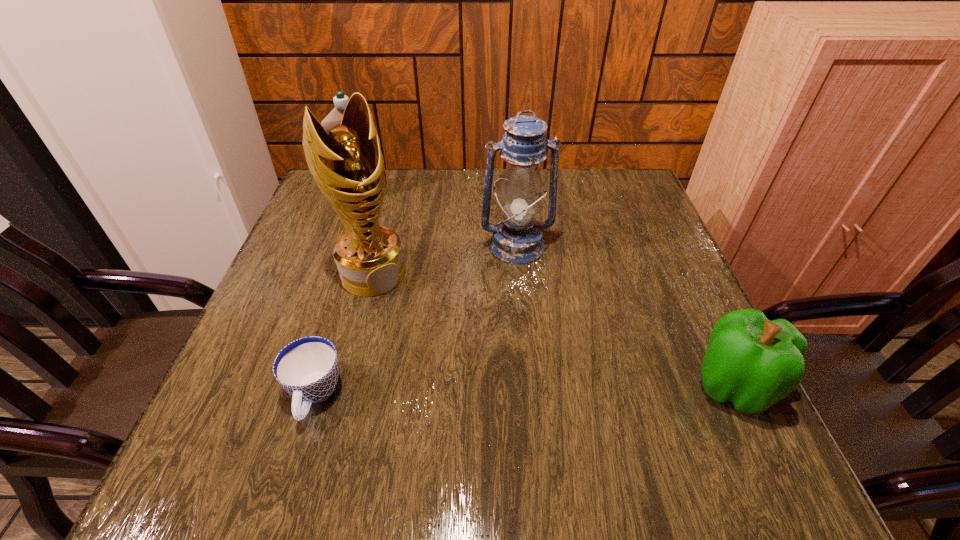
At what (x,y) coordinates should I click in order to perform the action: click on free space located 0.110m on the front-facing side of the award. Please return your answer as a coordinate pair (x, y). Looking at the image, I should click on (412, 326).

This screenshot has width=960, height=540. Find the location of `free point located on the front-facing side of the award`. free point located on the front-facing side of the award is located at coordinates (417, 332).

Image resolution: width=960 pixels, height=540 pixels. I want to click on vacant position located 0.170m on the front surface of the farthest object, so click(401, 234).

I want to click on free spot located 0.160m on the front surface of the farthest object, so click(x=399, y=232).

Identify the location of vacant space located on the front surface of the farthest object. pos(387,219).

The height and width of the screenshot is (540, 960). In order to click on vacant space located 0.200m on the front-facing side of the lantern in this screenshot , I will do `click(538, 333)`.

This screenshot has height=540, width=960. Identify the location of free region located 0.280m on the front-facing side of the lantern. (545, 366).

Where is `free space located on the front-facing side of the lantern`? The image size is (960, 540). free space located on the front-facing side of the lantern is located at coordinates (542, 353).

Image resolution: width=960 pixels, height=540 pixels. I want to click on object at the far edge, so click(334, 118).

This screenshot has height=540, width=960. In order to click on cup positioned at the near edge in this screenshot , I will do `click(308, 368)`.